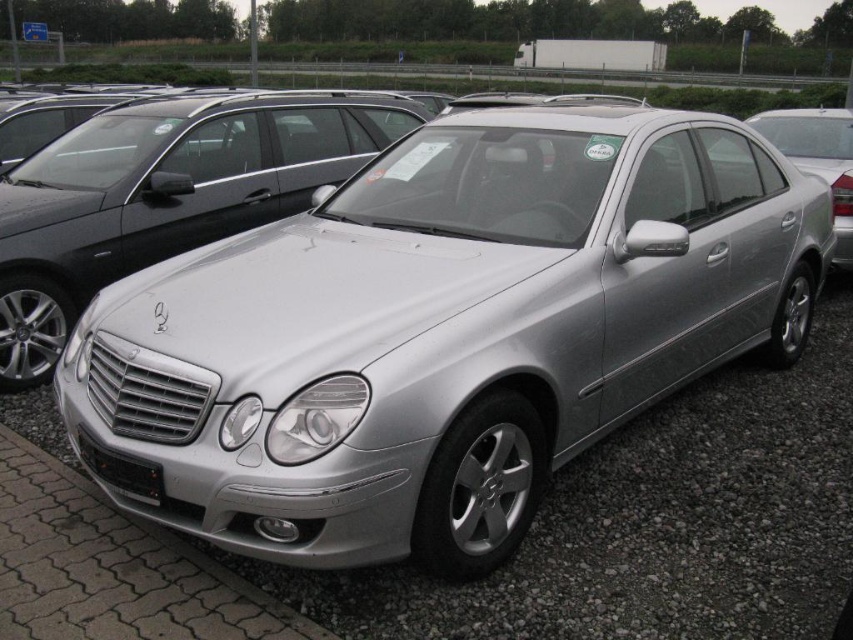
You are a delivery person with a package that needs to be placed between the silver metallic car at center and the silver metallic sedan at center. The package requires a minimum of 2.5 meters of space to be safely placed. Can the package be accommodated in the space between them?

The distance between the silver metallic car at center and the silver metallic sedan at center is 3.07 meters, which is more than the required 2.5 meters. Therefore, the package can be safely placed between them.